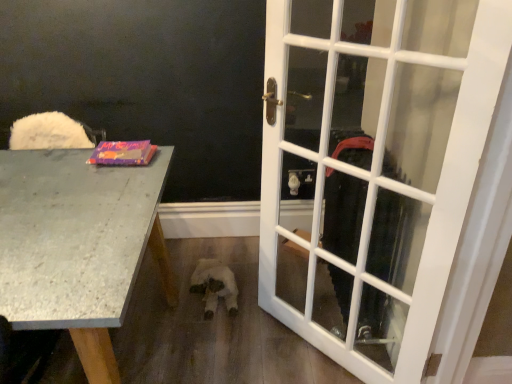
Question: From a real-world perspective, does granite gray desk at left stand above matte purple book at left?

Choices:
 (A) yes
 (B) no

Answer: (B)

Question: Is granite gray desk at left next to matte purple book at left and touching it?

Choices:
 (A) no
 (B) yes

Answer: (A)

Question: From a real-world perspective, is granite gray desk at left below matte purple book at left?

Choices:
 (A) yes
 (B) no

Answer: (A)

Question: Is granite gray desk at left wider than matte purple book at left?

Choices:
 (A) no
 (B) yes

Answer: (B)

Question: Is granite gray desk at left not within matte purple book at left?

Choices:
 (A) yes
 (B) no

Answer: (A)

Question: From the image's perspective, is white plush toy at center above or below granite gray desk at left?

Choices:
 (A) below
 (B) above

Answer: (A)

Question: From their relative heights in the image, would you say white plush toy at center is taller or shorter than granite gray desk at left?

Choices:
 (A) short
 (B) tall

Answer: (A)

Question: Based on their sizes in the image, would you say white plush toy at center is bigger or smaller than granite gray desk at left?

Choices:
 (A) small
 (B) big

Answer: (A)

Question: From a real-world perspective, is white plush toy at center physically located above or below granite gray desk at left?

Choices:
 (A) below
 (B) above

Answer: (A)

Question: Looking at their shapes, would you say white glass door at right is wider or thinner than matte purple book at left?

Choices:
 (A) wide
 (B) thin

Answer: (A)

Question: Is white glass door at right inside or outside of matte purple book at left?

Choices:
 (A) inside
 (B) outside

Answer: (B)

Question: From a real-world perspective, is white glass door at right positioned above or below matte purple book at left?

Choices:
 (A) below
 (B) above

Answer: (A)

Question: From the image's perspective, is white glass door at right positioned above or below matte purple book at left?

Choices:
 (A) below
 (B) above

Answer: (A)

Question: Do you think matte purple book at left is within white plush toy at center, or outside of it?

Choices:
 (A) outside
 (B) inside

Answer: (A)

Question: Is point (100, 145) positioned closer to the camera than point (203, 268)?

Choices:
 (A) closer
 (B) farther

Answer: (A)